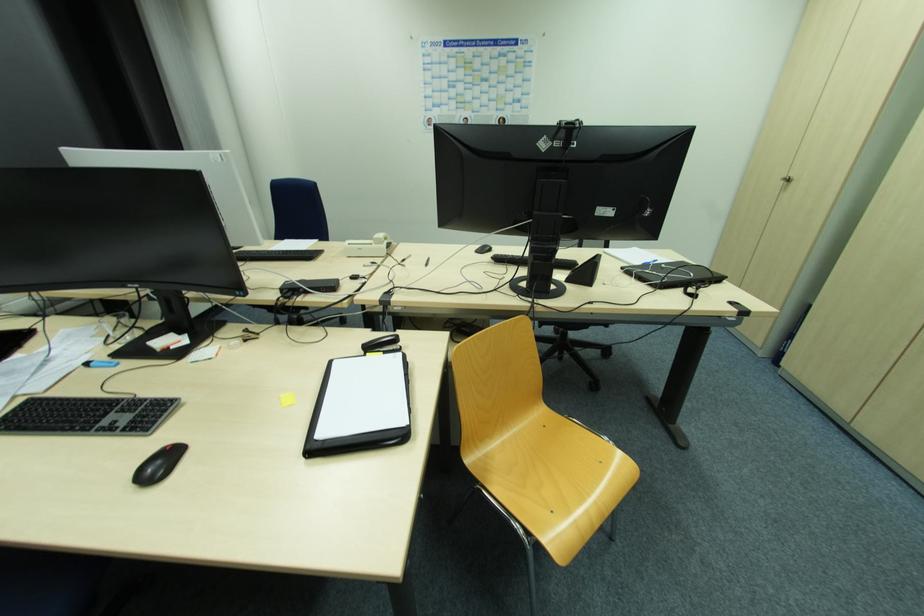
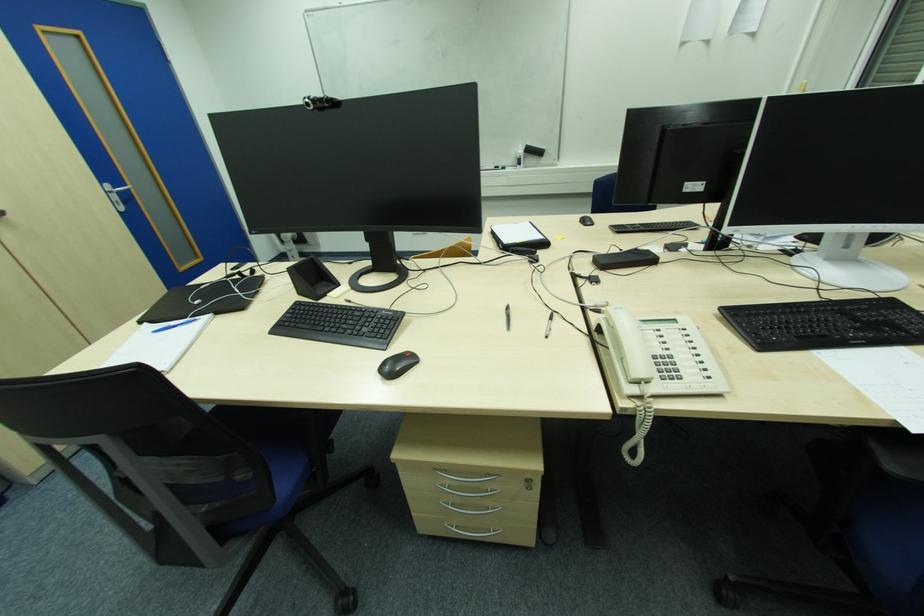
Question: I am providing you with two images of the same scene from different viewpoints. Please identify which objects are invisible in image2.

Choices:
 (A) silver door handle
 (B) silver drawer handle
 (C) yellow chair sitting surface
 (D) black object case

Answer: (C)